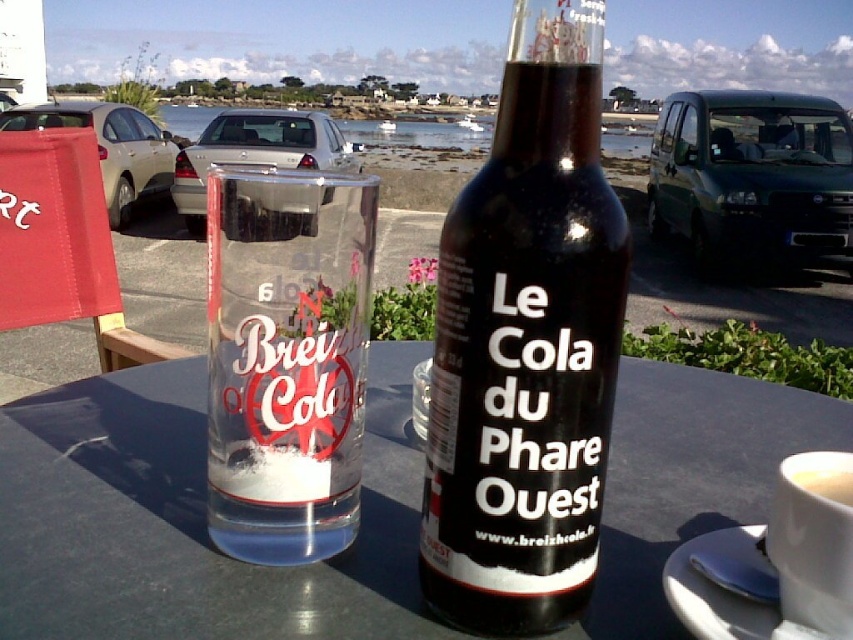
You are a delivery person who needs to place a package between the black glass bottle at center and the clear glass cup at center on the table. The package is 3 inches long. Can you fit it between them without moving the bottle or the cup?

The distance between the black glass bottle at center and the clear glass cup at center is 2.51 inches. Since the package is 3 inches long, it cannot fit between them without moving the bottle or the cup.

From the picture: You are setting up a table for a customer at the outdoor cafe. You have a transparent glass at center and a white ceramic saucer at lower right. Which item has a larger width?

The transparent glass at center has a larger width than the white ceramic saucer at lower right according to the description.

You are at a beachside cafe and want to know which item is thinner between the black glass bottle at center and the clear glass cup at center. Can you tell me?

The black glass bottle at center is thinner than the clear glass cup at center.